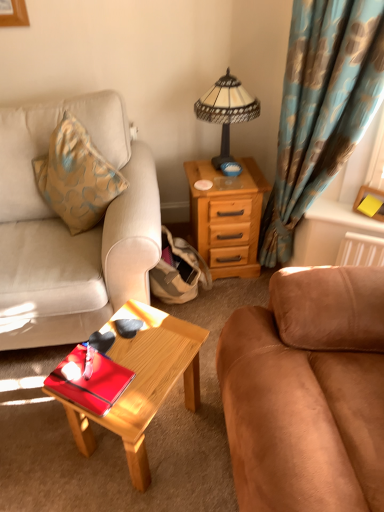
The width and height of the screenshot is (384, 512). What are the coordinates of `blank space situated above glossy red tray at center (from a real-world perspective)` in the screenshot? It's located at (94, 372).